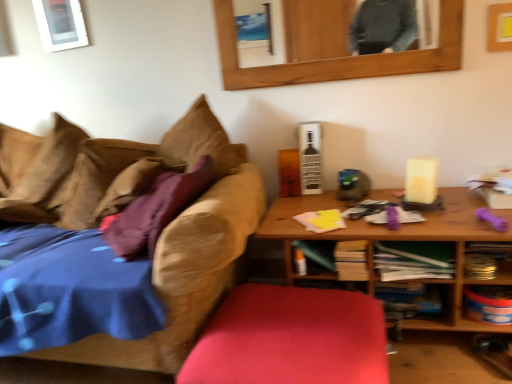
Question: Is metallic silver canister at lower right, the 2th shelf viewed from the top, to the left of wooden mirror at upper center from the viewer's perspective?

Choices:
 (A) yes
 (B) no

Answer: (B)

Question: Does metallic silver canister at lower right, the 2th shelf viewed from the top, have a smaller size compared to wooden mirror at upper center?

Choices:
 (A) yes
 (B) no

Answer: (A)

Question: Considering the relative sizes of metallic silver canister at lower right, the 1th shelf in the bottom-to-top sequence, and wooden mirror at upper center in the image provided, is metallic silver canister at lower right, the 1th shelf in the bottom-to-top sequence, bigger than wooden mirror at upper center?

Choices:
 (A) yes
 (B) no

Answer: (B)

Question: Does metallic silver canister at lower right, the 2th shelf viewed from the top, have a lesser height compared to wooden mirror at upper center?

Choices:
 (A) yes
 (B) no

Answer: (A)

Question: From the image's perspective, is metallic silver canister at lower right, the 2th shelf viewed from the top, located beneath wooden mirror at upper center?

Choices:
 (A) yes
 (B) no

Answer: (A)

Question: Is metallic silver canister at lower right, the 1th shelf in the bottom-to-top sequence, taller than wooden mirror at upper center?

Choices:
 (A) yes
 (B) no

Answer: (B)

Question: Does green paper at center, the 4th book from the left, contain yellow paper at center, positioned as the 3th book in right-to-left order?

Choices:
 (A) no
 (B) yes

Answer: (A)

Question: Is green paper at center, which is counted as the 1th book, starting from the right, at the right side of yellow paper at center, acting as the second book starting from the left?

Choices:
 (A) yes
 (B) no

Answer: (A)

Question: Is green paper at center, which is counted as the 1th book, starting from the right, bigger than yellow paper at center, acting as the second book starting from the left?

Choices:
 (A) yes
 (B) no

Answer: (A)

Question: Is green paper at center, which is counted as the 1th book, starting from the right, beside yellow paper at center, acting as the second book starting from the left?

Choices:
 (A) yes
 (B) no

Answer: (B)

Question: Considering the relative positions of green paper at center, the 4th book from the left, and yellow paper at center, acting as the second book starting from the left, in the image provided, is green paper at center, the 4th book from the left, to the left of yellow paper at center, acting as the second book starting from the left, from the viewer's perspective?

Choices:
 (A) yes
 (B) no

Answer: (B)

Question: Considering the relative positions of green paper at center, the 4th book from the left, and yellow paper at center, positioned as the 3th book in right-to-left order, in the image provided, is green paper at center, the 4th book from the left, behind yellow paper at center, positioned as the 3th book in right-to-left order,?

Choices:
 (A) no
 (B) yes

Answer: (A)

Question: Does smooth red cushion at center have a lesser width compared to wooden table at right?

Choices:
 (A) no
 (B) yes

Answer: (B)